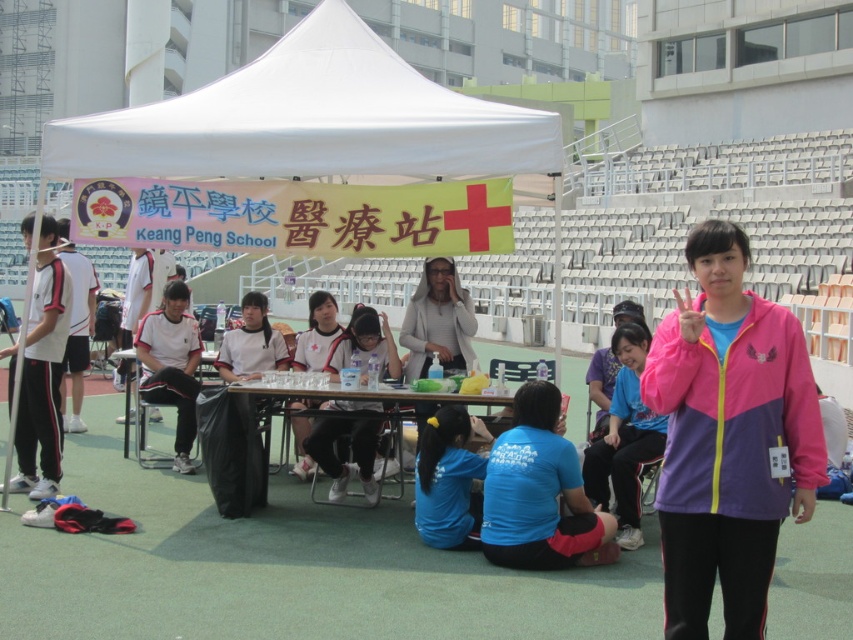
Question: Which point is closer to the camera?

Choices:
 (A) (723, 605)
 (B) (648, 429)
 (C) (306, 397)
 (D) (347, 339)

Answer: (A)

Question: Which of these objects is positioned farthest from the pink fabric jacket at lower right?

Choices:
 (A) white fabric canopy at upper center
 (B) pink fabric jacket at center
 (C) wooden table at center

Answer: (B)

Question: Can you confirm if white matte shirt at center is thinner than wooden table at center?

Choices:
 (A) no
 (B) yes

Answer: (B)

Question: Is pink fabric jacket at center below wooden table at center?

Choices:
 (A) yes
 (B) no

Answer: (B)

Question: Where is pink fabric jacket at lower right located in relation to wooden table at center in the image?

Choices:
 (A) right
 (B) left

Answer: (A)

Question: Which point is farther to the camera?

Choices:
 (A) white fabric canopy at upper center
 (B) pink fabric jacket at lower right
 (C) white matte shirt at center

Answer: (C)